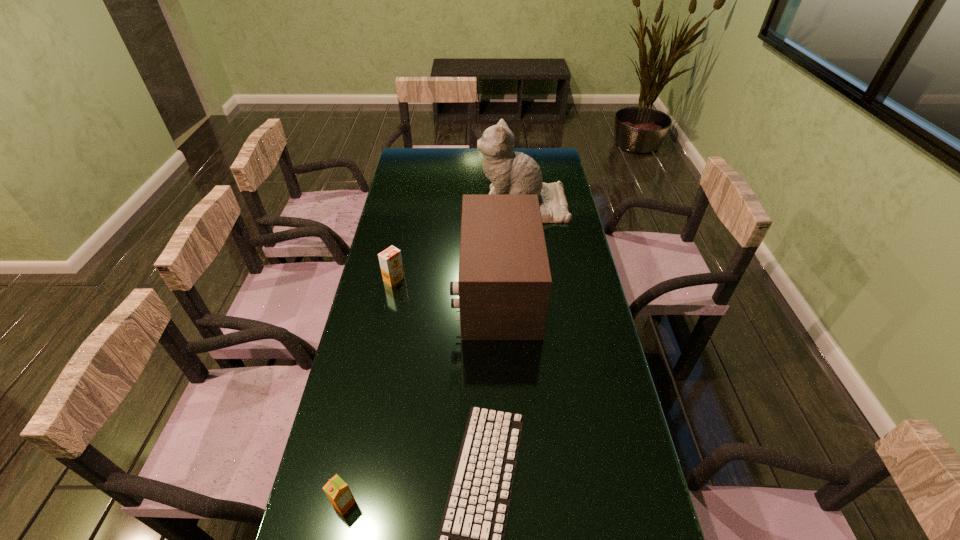
The width and height of the screenshot is (960, 540). Find the location of `blank space located on the front-facing side of the second tallest object`. blank space located on the front-facing side of the second tallest object is located at coordinates (368, 292).

At what (x,y) coordinates should I click in order to perform the action: click on vacant region located 0.060m on the front-facing side of the second tallest object. Please return your answer as a coordinate pair (x, y). The width and height of the screenshot is (960, 540). Looking at the image, I should click on (437, 292).

Identify the location of vacant space located on the front-facing side of the second tallest object. The width and height of the screenshot is (960, 540). (398, 292).

At what (x,y) coordinates should I click in order to perform the action: click on vacant region located 0.370m on the right of the farther orange juice. Please return your answer as a coordinate pair (x, y). Looking at the image, I should click on (512, 279).

Identify the location of free location located on the back of the nearer orange juice. (351, 469).

Find the location of a particular element. object present at the right edge is located at coordinates (512, 173).

You are a GUI agent. You are given a task and a screenshot of the screen. Output one action in this format:
    pyautogui.click(x=<x>, y=<y>)
    Task: Click on the vacant space at the far edge of the desktop
    The image size is (960, 540).
    Given the screenshot: What is the action you would take?
    pyautogui.click(x=461, y=148)

You are a GUI agent. You are given a task and a screenshot of the screen. Output one action in this format:
    pyautogui.click(x=<x>, y=<y>)
    Task: Click on the vacant area at the left edge of the desktop
    
    Given the screenshot: What is the action you would take?
    pyautogui.click(x=393, y=391)

Image resolution: width=960 pixels, height=540 pixels. Identify the location of free space at the right edge of the desktop. (556, 264).

This screenshot has width=960, height=540. In the image, there is a desktop. What are the coordinates of `free region at the far left corner` in the screenshot? It's located at (427, 165).